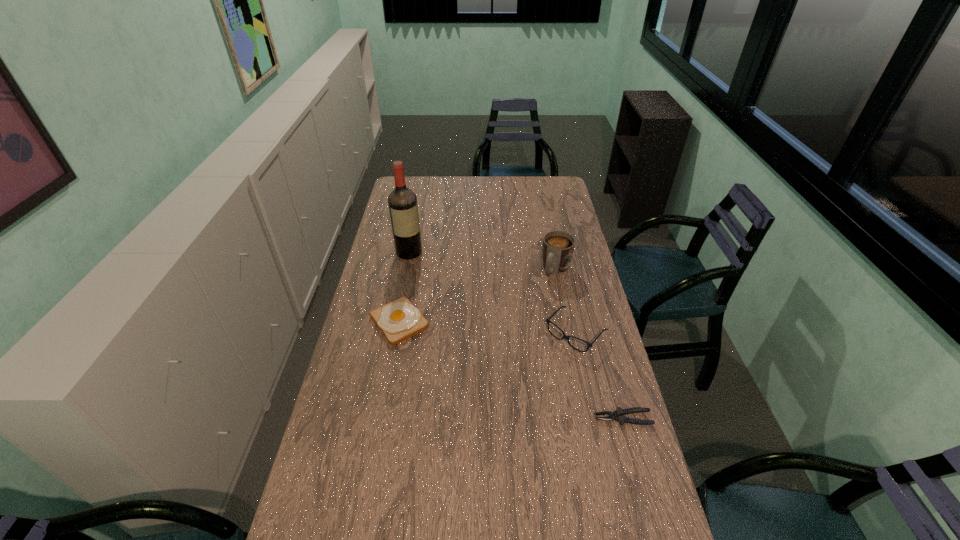
At what (x,y) coordinates should I click in order to perform the action: click on toast. Please return your answer as a coordinate pair (x, y). Looking at the image, I should click on (399, 320).

At what (x,y) coordinates should I click in order to perform the action: click on the shortest object. Please return your answer as a coordinate pair (x, y). The image size is (960, 540). Looking at the image, I should click on (618, 415).

You are a GUI agent. You are given a task and a screenshot of the screen. Output one action in this format:
    pyautogui.click(x=<x>, y=<y>)
    Task: Click on the pliers
    Image resolution: width=960 pixels, height=540 pixels.
    Given the screenshot: What is the action you would take?
    pyautogui.click(x=618, y=415)

Where is `the fourth shortest object`? The width and height of the screenshot is (960, 540). the fourth shortest object is located at coordinates (558, 246).

Identify the location of spectacles. This screenshot has width=960, height=540. (548, 321).

Where is `the tallest object`? the tallest object is located at coordinates (403, 208).

You are a GUI agent. You are given a task and a screenshot of the screen. Output one action in this format:
    pyautogui.click(x=<x>, y=<y>)
    Task: Click on the free point located 0.240m on the front of the fourth tallest object
    Image resolution: width=960 pixels, height=540 pixels.
    Given the screenshot: What is the action you would take?
    pyautogui.click(x=383, y=407)

Where is `free space located 0.170m at the gripping part of the nearest object`? free space located 0.170m at the gripping part of the nearest object is located at coordinates (538, 418).

Locate an element on the screen. vacant space located 0.130m at the gripping part of the nearest object is located at coordinates (x=551, y=418).

Find the location of `vacant position located 0.230m at the gripping part of the nearest object`. vacant position located 0.230m at the gripping part of the nearest object is located at coordinates (516, 418).